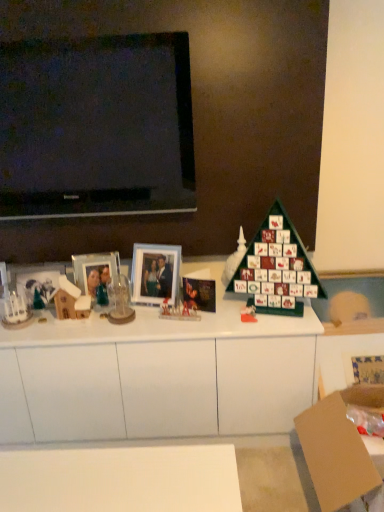
Where is `free space in front of translucent glass figurine at center, placed as the second toy when sorted from left to right`? This screenshot has height=512, width=384. free space in front of translucent glass figurine at center, placed as the second toy when sorted from left to right is located at coordinates (177, 332).